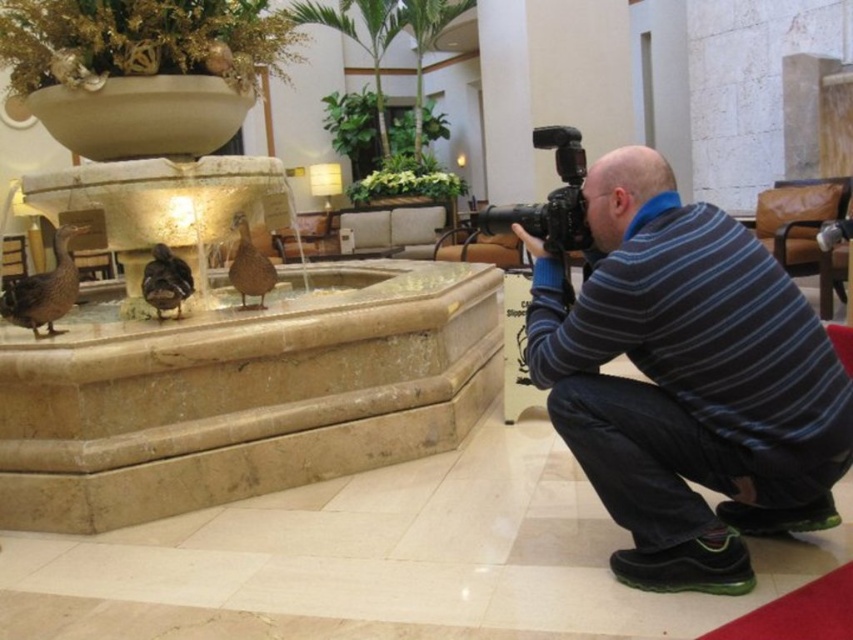
You are standing in the luxurious indoor setting and want to place a small potted plant between the beige marble fountain at lower left and the blue striped sweater at lower right. Based on their positions, where should you position the potted plant to be centered between them?

The beige marble fountain at lower left is above the blue striped sweater at lower right, so to center the potted plant between them, place it halfway between their vertical positions.